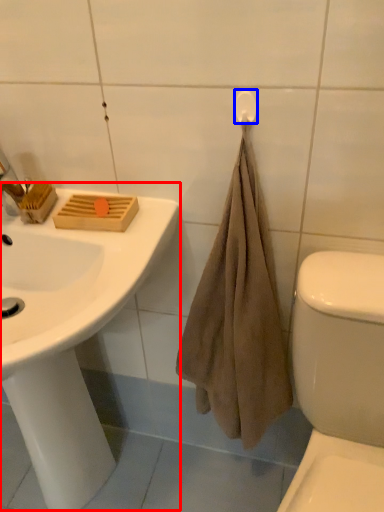
Question: Among these objects, which one is farthest to the camera, sink (highlighted by a red box) or towel bar (highlighted by a blue box)?

Choices:
 (A) sink
 (B) towel bar

Answer: (B)